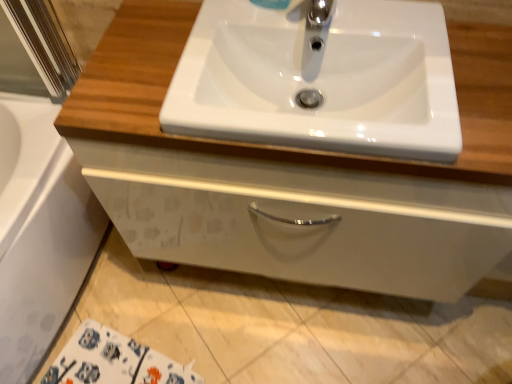
Question: From a real-world perspective, is white glossy cabinet at center physically located above or below white glossy bath at lower left?

Choices:
 (A) below
 (B) above

Answer: (B)

Question: Considering the positions of white glossy cabinet at center and white glossy bath at lower left in the image, is white glossy cabinet at center bigger or smaller than white glossy bath at lower left?

Choices:
 (A) small
 (B) big

Answer: (A)

Question: Which is farther from the chrome metallic faucet at upper center?

Choices:
 (A) white glossy sink at center
 (B) white glossy bath at lower left
 (C) white glossy cabinet at center

Answer: (B)

Question: Considering the real-world distances, which object is farthest from the chrome metallic faucet at upper center?

Choices:
 (A) white glossy bath at lower left
 (B) white glossy cabinet at center
 (C) white glossy sink at center

Answer: (A)